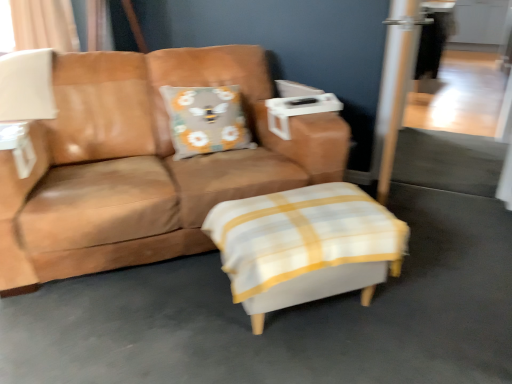
Question: Does brown leather couch at center have a greater height compared to white fabric ottoman at center?

Choices:
 (A) yes
 (B) no

Answer: (A)

Question: Is white fabric ottoman at center located within brown leather couch at center?

Choices:
 (A) no
 (B) yes

Answer: (A)

Question: Could you tell me if brown leather couch at center is turned towards white fabric ottoman at center?

Choices:
 (A) yes
 (B) no

Answer: (A)

Question: Does brown leather couch at center lie in front of white fabric ottoman at center?

Choices:
 (A) yes
 (B) no

Answer: (B)

Question: Considering the relative sizes of brown leather couch at center and white fabric ottoman at center in the image provided, is brown leather couch at center wider than white fabric ottoman at center?

Choices:
 (A) yes
 (B) no

Answer: (A)

Question: Considering the relative sizes of brown leather couch at center and white fabric ottoman at center in the image provided, is brown leather couch at center shorter than white fabric ottoman at center?

Choices:
 (A) no
 (B) yes

Answer: (A)

Question: Are brown leather couch at center and transparent glass screen door at upper right located far from each other?

Choices:
 (A) yes
 (B) no

Answer: (A)

Question: Can you confirm if brown leather couch at center is taller than transparent glass screen door at upper right?

Choices:
 (A) yes
 (B) no

Answer: (B)

Question: Is brown leather couch at center further to the viewer compared to transparent glass screen door at upper right?

Choices:
 (A) yes
 (B) no

Answer: (B)

Question: Does brown leather couch at center have a lesser height compared to transparent glass screen door at upper right?

Choices:
 (A) no
 (B) yes

Answer: (B)

Question: Can you confirm if brown leather couch at center is positioned to the left of transparent glass screen door at upper right?

Choices:
 (A) no
 (B) yes

Answer: (B)

Question: From a real-world perspective, is brown leather couch at center positioned over transparent glass screen door at upper right based on gravity?

Choices:
 (A) yes
 (B) no

Answer: (B)

Question: Considering the relative sizes of white fabric ottoman at center and gray fabric pillow with bee design at center in the image provided, is white fabric ottoman at center wider than gray fabric pillow with bee design at center?

Choices:
 (A) no
 (B) yes

Answer: (B)